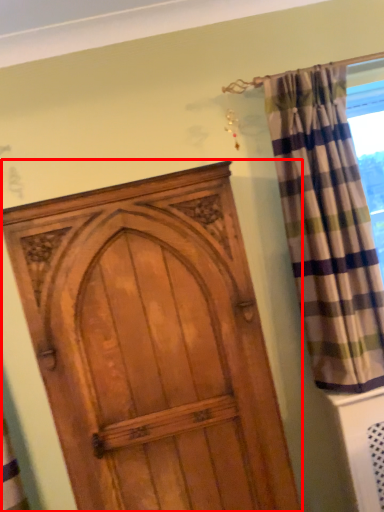
Question: Where is door (annotated by the red box) located in relation to curtain in the image?

Choices:
 (A) right
 (B) left

Answer: (B)